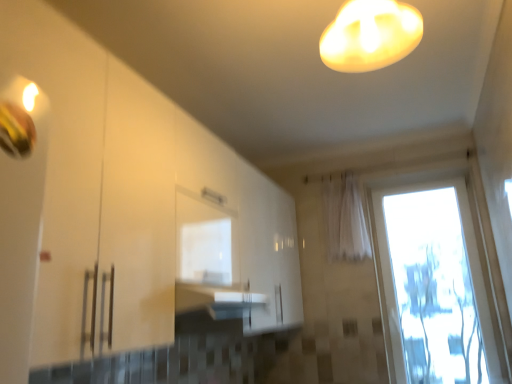
Question: Would you say white sheer curtain at center is inside or outside white glossy lampshade at upper center?

Choices:
 (A) outside
 (B) inside

Answer: (A)

Question: From the image's perspective, is white sheer curtain at center located above or below white glossy lampshade at upper center?

Choices:
 (A) above
 (B) below

Answer: (B)

Question: Considering the real-world distances, which object is farthest from the white glossy lampshade at upper center?

Choices:
 (A) white sheer curtain at center
 (B) white glossy cabinet at center
 (C) transparent glass door at right

Answer: (C)

Question: Considering the real-world distances, which object is closest to the white glossy lampshade at upper center?

Choices:
 (A) white sheer curtain at center
 (B) transparent glass door at right
 (C) white glossy cabinet at center

Answer: (C)